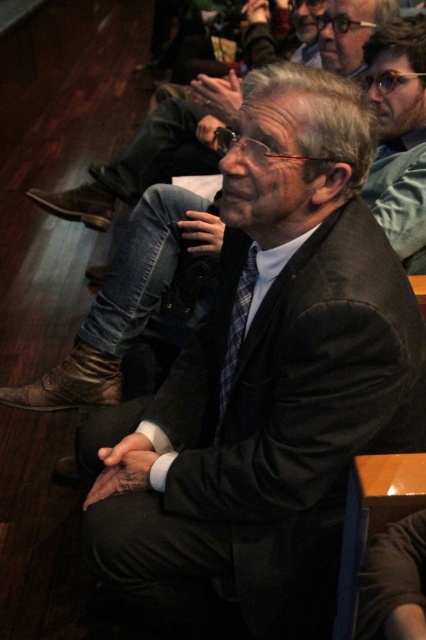
You are an event planner organizing a photo shoot in the auditorium. You need to position a camera so that both the black woolen suit at center and the black wool suit at center are visible in the frame. Is there any issue with capturing both in the same shot?

The black woolen suit at center is in front of the black wool suit at center, so there might be an issue capturing both clearly in the same shot as the one in front could obscure the one behind.

Consider the image. You are standing in the auditorium and want to take a photo of the point at coordinates (x=293, y=365). The camera you are using has a minimum focus distance of 38 inches. Will the camera be able to focus on the point?

The point at coordinates (x=293, y=365) is 37.51 inches away from the camera, which is less than the camera minimum focus distance of 38 inches. Therefore, the camera will not be able to focus on the point.